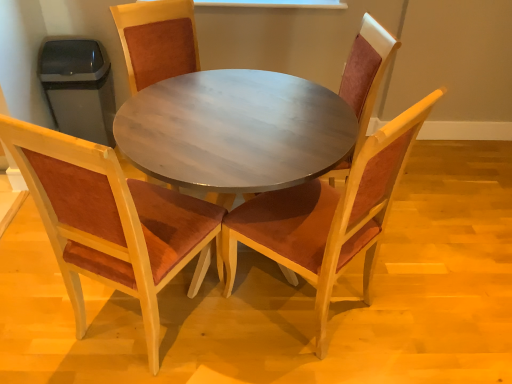
Question: Do you think velvet red chair at center, the third chair when ordered from left to right, is within velvet burgundy chair at center, which appears as the fourth chair when viewed from the left, or outside of it?

Choices:
 (A) inside
 (B) outside

Answer: (B)

Question: From a real-world perspective, is velvet red chair at center, the third chair when ordered from left to right, physically located above or below velvet burgundy chair at center, which is the first chair in right-to-left order?

Choices:
 (A) above
 (B) below

Answer: (B)

Question: Which object is the farthest from the wooden table at center?

Choices:
 (A) matte wood table at center
 (B) velvet red chair at center, which is counted as the second chair, starting from the right
 (C) velvet burgundy chair at center, which appears as the fourth chair when viewed from the left
 (D) velvet brown chair at left, arranged as the first chair when viewed from the left
 (E) wooden chair with brown cushion at center, acting as the third chair starting from the right

Answer: (E)

Question: Estimate the real-world distances between objects in this image. Which object is closer to the velvet red chair at center, the third chair when ordered from left to right?

Choices:
 (A) wooden chair with brown cushion at center, acting as the third chair starting from the right
 (B) velvet brown chair at left, arranged as the first chair when viewed from the left
 (C) wooden table at center
 (D) velvet burgundy chair at center, which is the first chair in right-to-left order
 (E) matte wood table at center

Answer: (D)